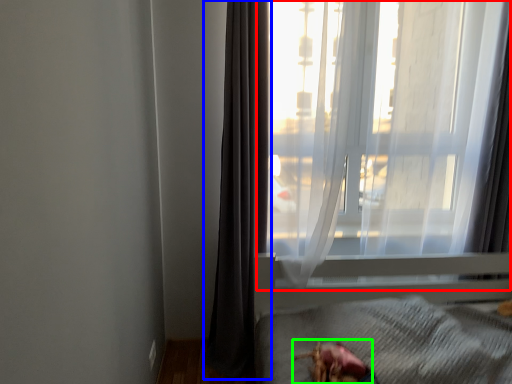
Question: Which object is positioned farthest from window (highlighted by a red box)? Select from curtain (highlighted by a blue box) and animal (highlighted by a green box).

Choices:
 (A) curtain
 (B) animal

Answer: (B)